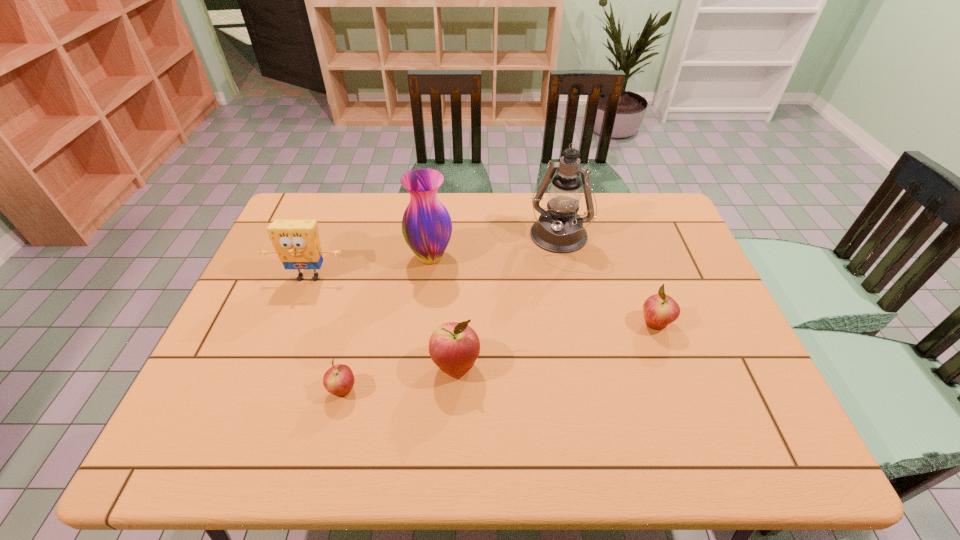
Locate an element on the screen. the shortest apple is located at coordinates (339, 379).

Find the location of a particular element. The height and width of the screenshot is (540, 960). the shortest object is located at coordinates (339, 379).

Image resolution: width=960 pixels, height=540 pixels. What are the coordinates of `the tallest apple` in the screenshot? It's located at (454, 347).

You are a GUI agent. You are given a task and a screenshot of the screen. Output one action in this format:
    pyautogui.click(x=<x>, y=<y>)
    Task: Click on the rightmost apple
    The width and height of the screenshot is (960, 540).
    Given the screenshot: What is the action you would take?
    pyautogui.click(x=659, y=310)

At what (x,y) coordinates should I click in order to perform the action: click on the second tallest apple. Please return your answer as a coordinate pair (x, y). Looking at the image, I should click on (659, 310).

Where is `vase`? vase is located at coordinates (426, 225).

Locate an element on the screen. Image resolution: width=960 pixels, height=540 pixels. oil lamp is located at coordinates (559, 229).

Find the location of a particular element. the leftmost object is located at coordinates (296, 242).

This screenshot has width=960, height=540. I want to click on vacant space situated 0.210m on the back of the leftmost apple, so click(x=363, y=310).

Locate an element on the screen. This screenshot has height=540, width=960. free point located 0.300m on the right of the second apple from right to left is located at coordinates (604, 366).